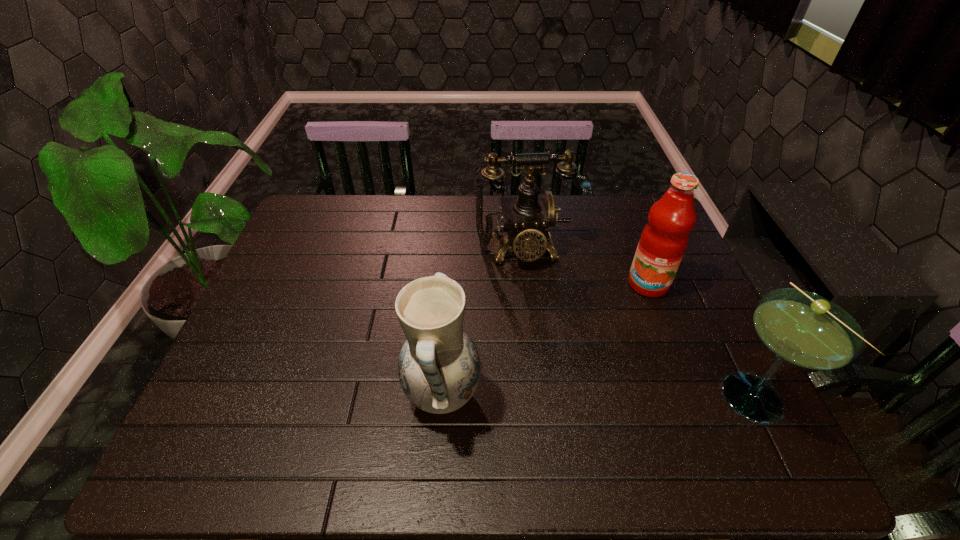
This screenshot has width=960, height=540. What are the coordinates of `vacant space located 0.050m on the rotary dial of the telephone` in the screenshot? It's located at (529, 284).

Locate an element on the screen. This screenshot has height=540, width=960. free space located 0.060m on the rotary dial of the telephone is located at coordinates (529, 287).

Where is `object present at the far edge`? object present at the far edge is located at coordinates pos(526,218).

Locate an element on the screen. pottery at the near edge is located at coordinates (439, 367).

Locate an element on the screen. The height and width of the screenshot is (540, 960). martini at the near edge is located at coordinates (801, 328).

This screenshot has width=960, height=540. Find the location of `martini that is at the right edge`. martini that is at the right edge is located at coordinates (801, 328).

You are a GUI agent. You are given a task and a screenshot of the screen. Output one action in this format:
    pyautogui.click(x=<x>, y=<y>)
    Task: Click on the fruit juice at the right edge
    This screenshot has height=540, width=960.
    Given the screenshot: What is the action you would take?
    pyautogui.click(x=663, y=241)

This screenshot has height=540, width=960. In order to click on object that is at the near right corner in this screenshot , I will do `click(801, 328)`.

Identify the location of free region at the far edge of the desktop. The image size is (960, 540). (600, 228).

This screenshot has height=540, width=960. Find the location of `free space at the far right corner of the desktop`. free space at the far right corner of the desktop is located at coordinates (632, 221).